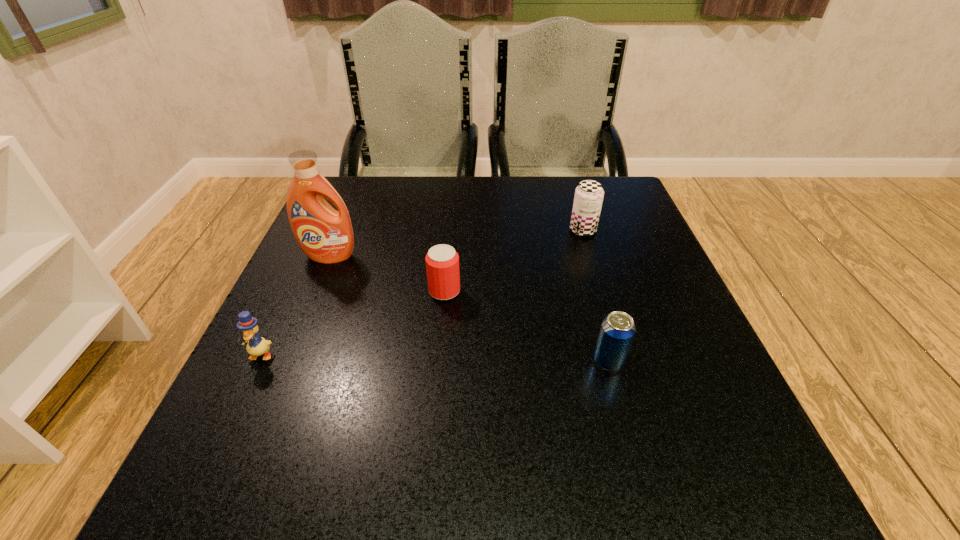
This screenshot has height=540, width=960. Identify the location of free space at the right edge. (633, 260).

This screenshot has width=960, height=540. Identify the location of free space at the far left corner of the desktop. (386, 178).

The width and height of the screenshot is (960, 540). I want to click on free space at the near left corner, so click(308, 490).

In the image, there is a desktop. Where is `vacant space at the far right corner`? vacant space at the far right corner is located at coordinates (608, 177).

At what (x,y) coordinates should I click in order to perform the action: click on empty space that is in between the duckling and the second farthest object. Please return your answer as a coordinate pair (x, y). The height and width of the screenshot is (540, 960). Looking at the image, I should click on click(295, 306).

In order to click on free space between the detergent and the leftmost beer can in this screenshot , I will do `click(387, 274)`.

This screenshot has width=960, height=540. Identify the location of vacant space in between the leftmost beer can and the farthest beer can. (514, 261).

Find the location of a particular element. The width and height of the screenshot is (960, 540). unoccupied position between the duckling and the nearest beer can is located at coordinates pos(435,358).

Where is `empty space that is in between the nearest beer can and the tallest beer can`? empty space that is in between the nearest beer can and the tallest beer can is located at coordinates (596, 296).

Image resolution: width=960 pixels, height=540 pixels. Find the location of `free space between the duckling and the tallest object`. free space between the duckling and the tallest object is located at coordinates (295, 306).